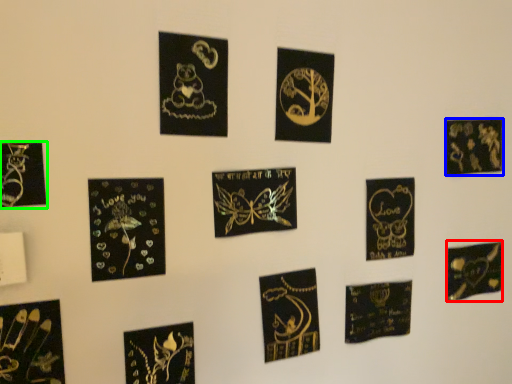
Question: Which object is positioned farthest from postcard (highlighted by a red box)? Select from picture frame (highlighted by a blue box) and picture frame (highlighted by a green box).

Choices:
 (A) picture frame
 (B) picture frame

Answer: (B)